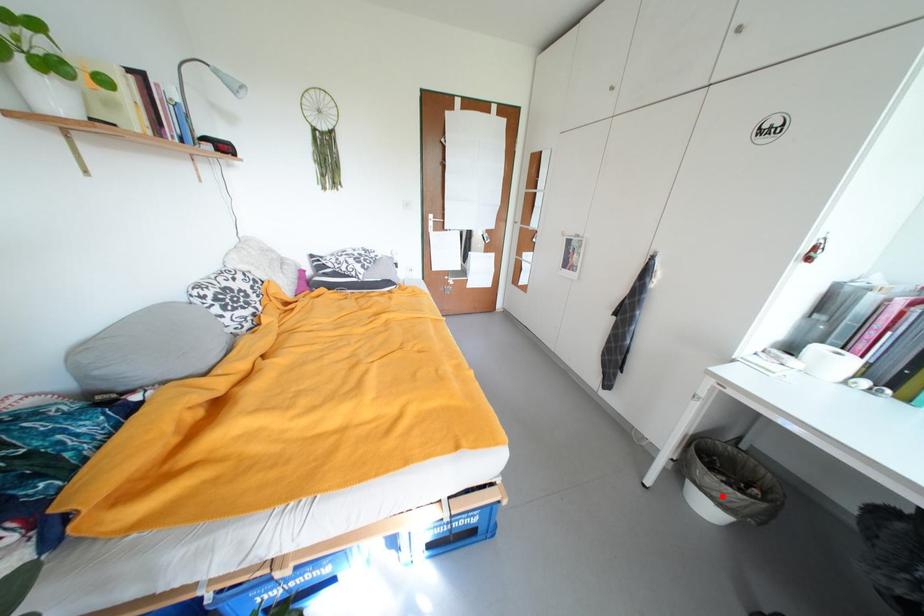
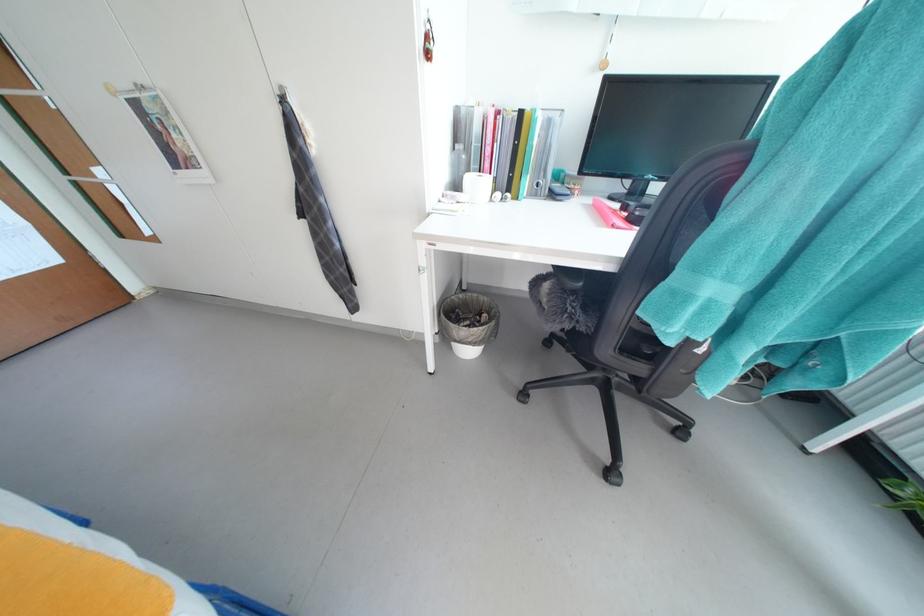
Question: I am providing you with two images of the same scene from different viewpoints. In image1, a red point is highlighted. Considering the same 3D point in image2, which of the following is correct?

Choices:
 (A) It is closer
 (B) It is farther

Answer: (B)